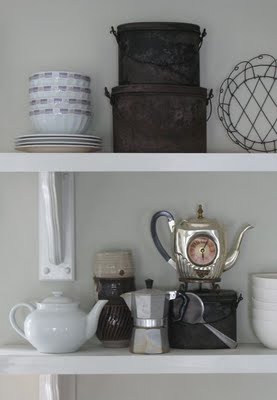
Locate an element on the screen. This screenshot has height=400, width=277. stack of plates is located at coordinates (66, 139).